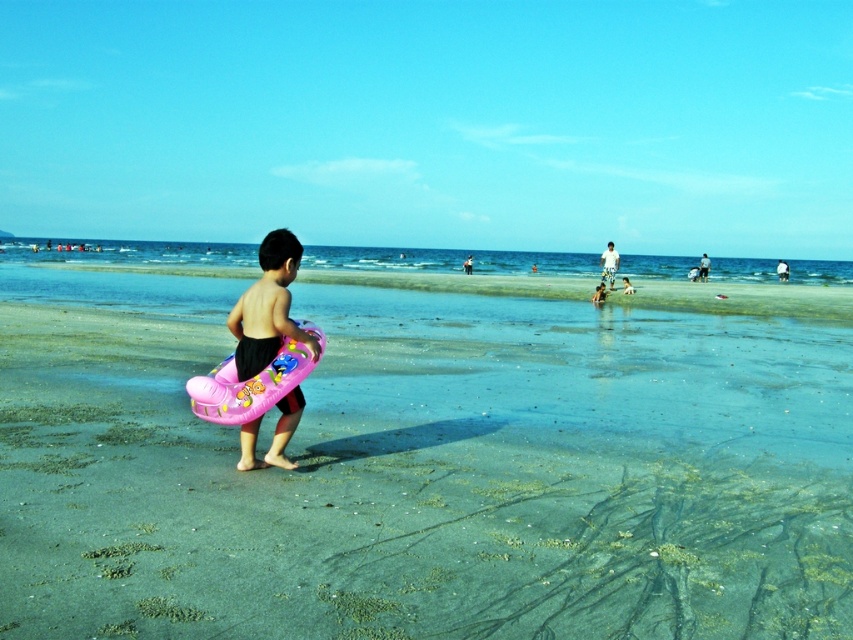
Question: Does clear blue water at center lie behind pink inflatable ring at center?

Choices:
 (A) yes
 (B) no

Answer: (A)

Question: Does pink rubber ring at center appear on the right side of clear blue water at center?

Choices:
 (A) yes
 (B) no

Answer: (B)

Question: Which is farther from the clear blue water at center?

Choices:
 (A) pink inflatable ring at center
 (B) pink rubber ring at center

Answer: (A)

Question: Does clear blue water at center have a smaller size compared to pink inflatable ring at center?

Choices:
 (A) no
 (B) yes

Answer: (A)

Question: Which of these objects is positioned farthest from the clear blue water at center?

Choices:
 (A) pink inflatable ring at center
 (B) pink rubber ring at center

Answer: (A)

Question: Which object is farther from the camera taking this photo?

Choices:
 (A) pink rubber ring at center
 (B) clear blue water at center

Answer: (B)